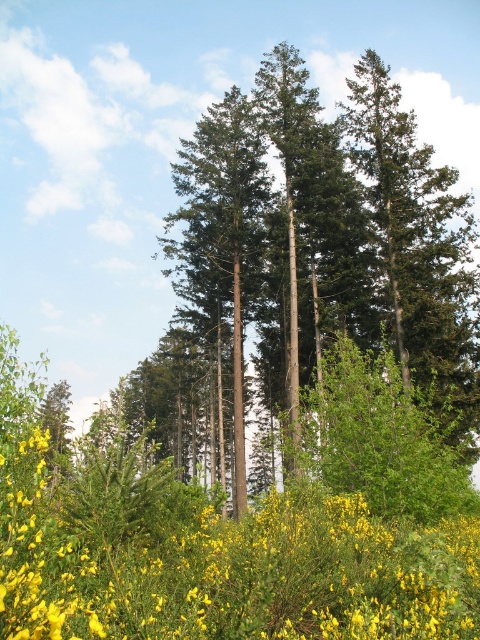
How much distance is there between yellow matte flower at center and green rough bark trees at center?

yellow matte flower at center is 115.89 feet away from green rough bark trees at center.

You are a GUI agent. You are given a task and a screenshot of the screen. Output one action in this format:
    pyautogui.click(x=<x>, y=<y>)
    Task: Click on the yellow matte flower at center
    
    Given the screenshot: What is the action you would take?
    pyautogui.click(x=220, y=563)

Where is `yellow matte flower at center`? The image size is (480, 640). yellow matte flower at center is located at coordinates (220, 563).